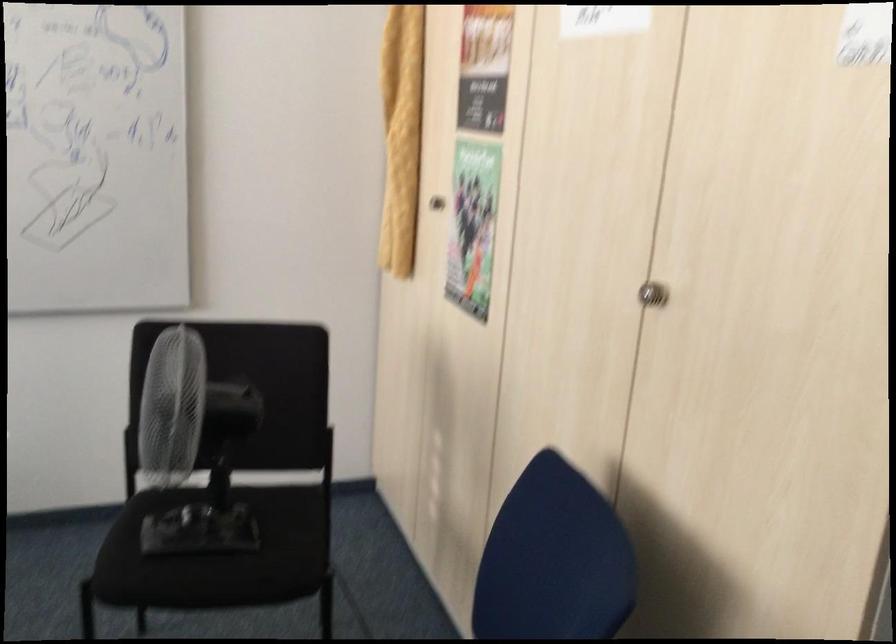
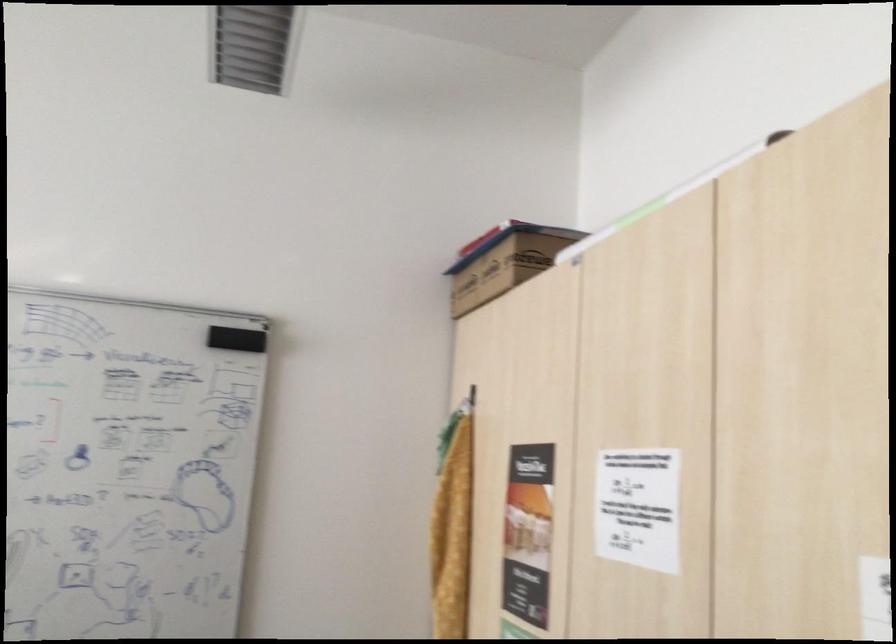
Question: The first image is from the beginning of the video and the second image is from the end. How did the camera likely rotate when shooting the video?

Choices:
 (A) Left
 (B) Right
 (C) Up
 (D) Down

Answer: (C)